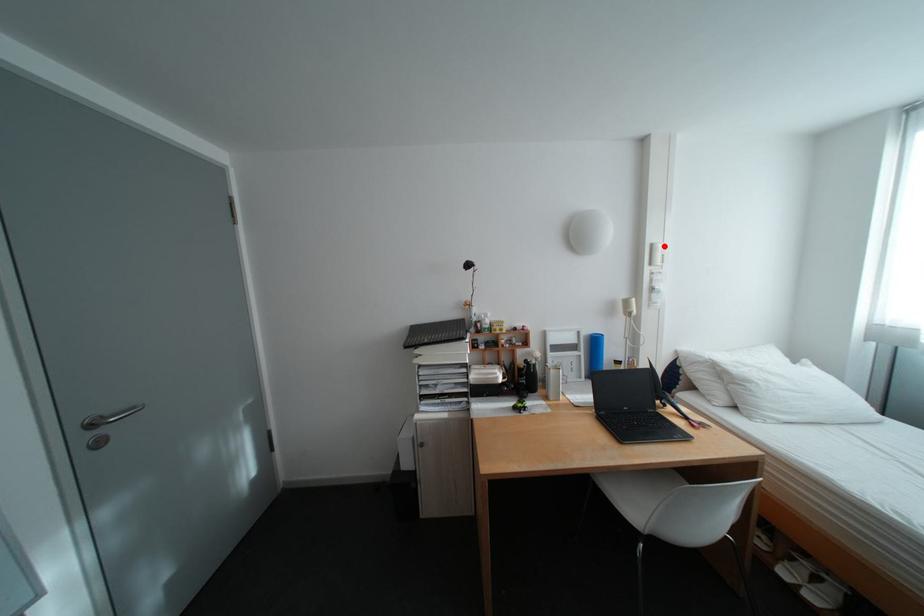
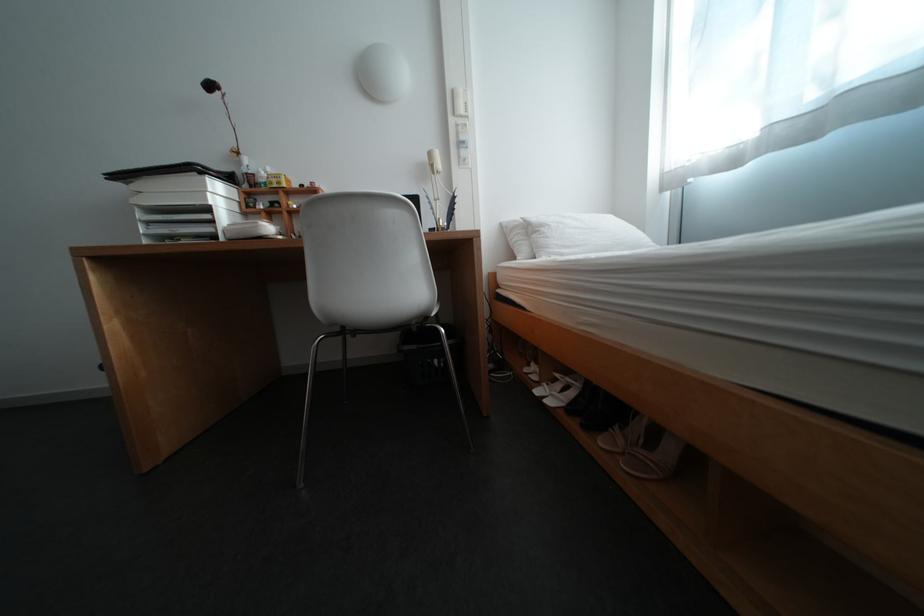
Find the pixel in the second image that matches the highlighted location in the first image.

(466, 92)